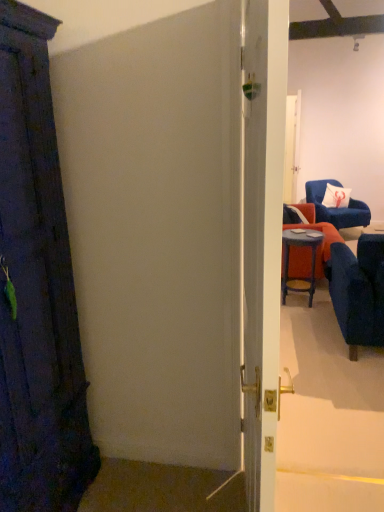
Question: From a real-world perspective, is matte blue stool at right over velvet blue armchair at upper right, acting as the 1th chair starting from the back?

Choices:
 (A) no
 (B) yes

Answer: (A)

Question: Does matte blue stool at right have a lesser height compared to velvet blue armchair at upper right, arranged as the 1th chair when viewed from the top?

Choices:
 (A) yes
 (B) no

Answer: (A)

Question: From the image's perspective, is matte blue stool at right under velvet blue armchair at upper right, arranged as the 2th chair when ordered from the bottom?

Choices:
 (A) no
 (B) yes

Answer: (B)

Question: Is matte blue stool at right directly adjacent to velvet blue armchair at upper right, marked as the 2th chair in a left-to-right arrangement?

Choices:
 (A) yes
 (B) no

Answer: (B)

Question: Is matte blue stool at right smaller than velvet blue armchair at upper right, arranged as the 2th chair when ordered from the bottom?

Choices:
 (A) yes
 (B) no

Answer: (A)

Question: Does matte blue stool at right have a greater width compared to velvet blue armchair at upper right, arranged as the 2th chair when ordered from the bottom?

Choices:
 (A) no
 (B) yes

Answer: (A)

Question: Is velvet blue armchair at upper right, arranged as the 2th chair when ordered from the bottom, surrounding velvet blue armchair at right, which is the 2th chair in back-to-front order?

Choices:
 (A) yes
 (B) no

Answer: (B)

Question: From the image's perspective, is velvet blue armchair at upper right, arranged as the 2th chair when ordered from the bottom, located beneath velvet blue armchair at right, placed as the first chair when sorted from left to right?

Choices:
 (A) yes
 (B) no

Answer: (B)

Question: Is velvet blue armchair at upper right, acting as the 1th chair starting from the back, positioned in front of velvet blue armchair at right, which ranks as the first chair in front-to-back order?

Choices:
 (A) yes
 (B) no

Answer: (B)

Question: Is velvet blue armchair at upper right, positioned as the first chair in right-to-left order, facing towards velvet blue armchair at right, arranged as the first chair when ordered from the bottom?

Choices:
 (A) yes
 (B) no

Answer: (B)

Question: From a real-world perspective, is velvet blue armchair at upper right, the second chair from the front, under velvet blue armchair at right, which ranks as the first chair in front-to-back order?

Choices:
 (A) no
 (B) yes

Answer: (B)

Question: Can you confirm if velvet blue armchair at upper right, acting as the 1th chair starting from the back, is positioned to the left of velvet blue armchair at right, which ranks as the first chair in front-to-back order?

Choices:
 (A) no
 (B) yes

Answer: (A)

Question: Could you tell me if white fabric pillow at upper right is turned towards matte blue stool at right?

Choices:
 (A) no
 (B) yes

Answer: (A)